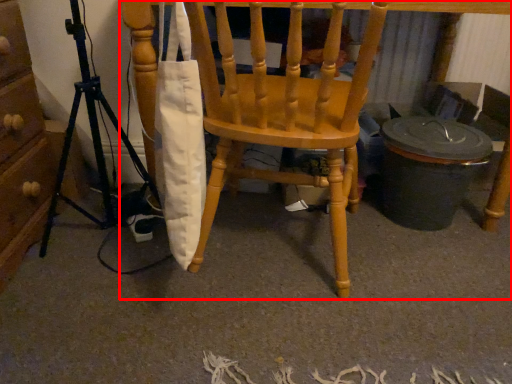
Question: From the image's perspective, what is the correct spatial relationship of chair (annotated by the red box) in relation to tripod?

Choices:
 (A) above
 (B) below

Answer: (A)